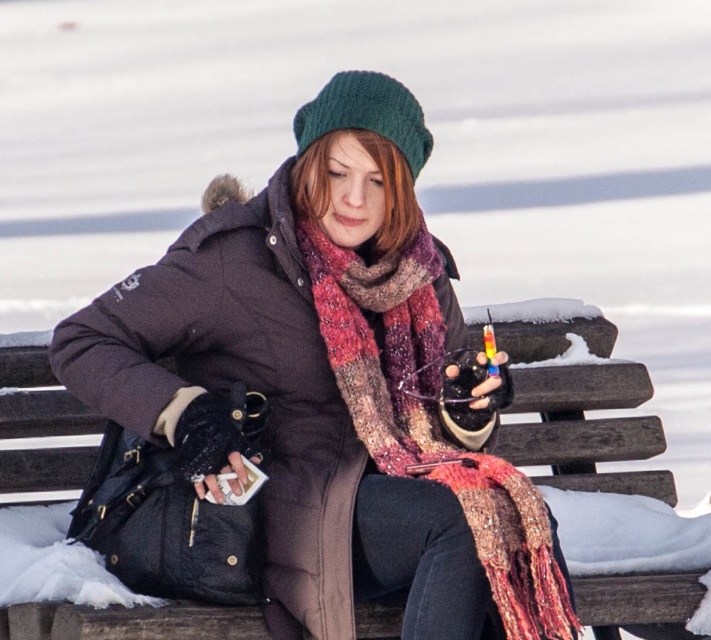
You are taking a photo of the snowy bench scene. You want to focus on the point closer to the camera. Which point should you choose between point (274, 525) and point (574, 632)?

You should focus on point (274, 525) because it is closer to the camera than point (574, 632).

You are standing at the origin point in the image. The brown wooden bench at center is at coordinates 0.723 on the x and 0.842 on the y. If you want to walk directly to the bench, which direction should you move in terms of x and y coordinates?

To reach the brown wooden bench at center located at coordinates x 0.723 and y 0.842 from the origin, you should move in the positive x and positive y direction since both coordinates are greater than zero.

You are a fashion designer analyzing the winter outfit of the person sitting on the wooden bench. The person is wearing a dark puffer jacket with a fur lined hood, a green knit beanie, a multicolored scarf, and black gloves. You notice a specific point at coordinates point (320,401). What item of clothing is located at that point?

The point (320,401) indicates the matte black coat at center.